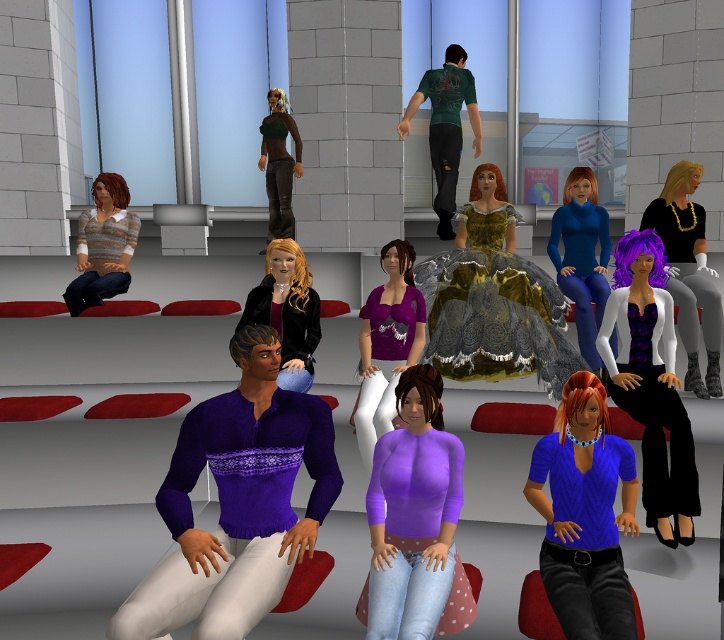
Question: Which object is farther from the camera taking this photo?

Choices:
 (A) matte black dress at center
 (B) blue matte dress at center
 (C) blue matte shirt at center
 (D) purple matte shirt at center

Answer: (B)

Question: Which object appears farthest from the camera in this image?

Choices:
 (A) shiny gold dress at center
 (B) matte black dress at center
 (C) matte brown leather jacket at center
 (D) blue matte shirt at center

Answer: (C)

Question: Among these objects, which one is farthest from the camera?

Choices:
 (A) matte black dress at center
 (B) blue matte dress at center

Answer: (B)

Question: Does blue matte dress at center appear on the left side of striped sweater at left?

Choices:
 (A) yes
 (B) no

Answer: (B)

Question: Is white matte vest at center below matte brown leather jacket at center?

Choices:
 (A) yes
 (B) no

Answer: (A)

Question: Is gold textured gown at center closer to the viewer compared to white matte vest at center?

Choices:
 (A) no
 (B) yes

Answer: (A)